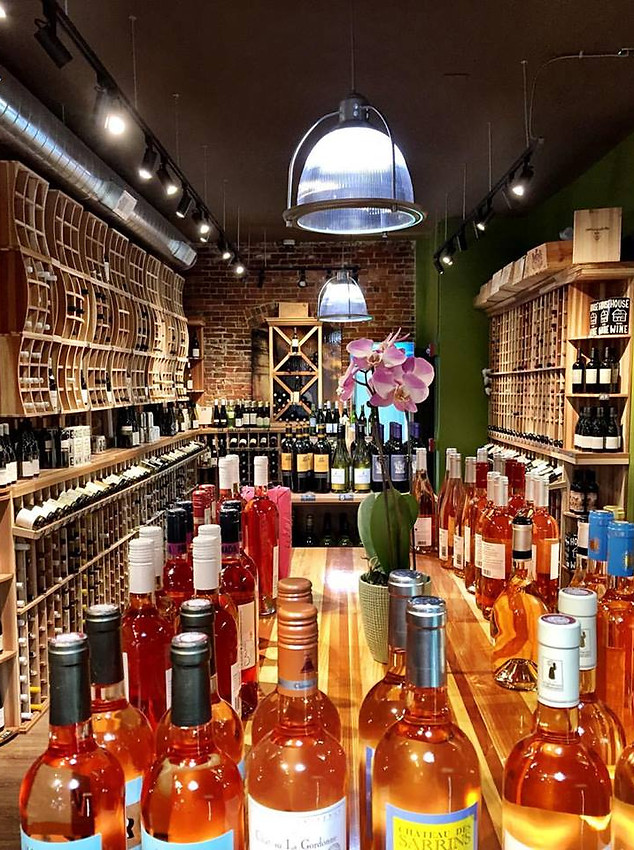
Locate an element on the screen. The height and width of the screenshot is (850, 634). pink orchid petals is located at coordinates tap(361, 350).